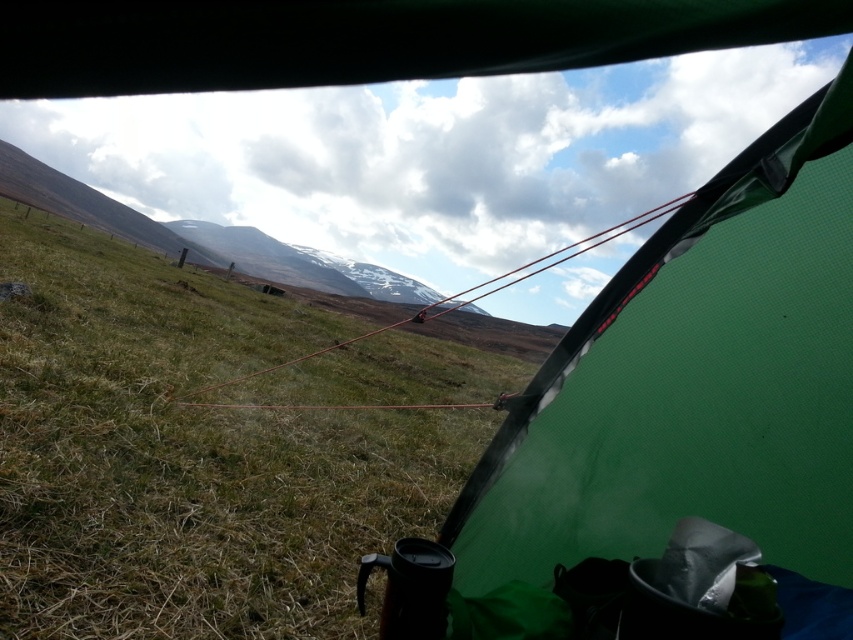
You are setting up a tent and want to place a small bag on the ground near the tent. Based on the scene, where should you place the bag so it is closer to the green mesh tent at center but still on the green grassy at lower left?

The green grassy at lower left is located above the green mesh tent at center, so placing the bag on the green grassy at lower left area near the tent would position it closer to the tent while remaining on the grass.

You are setting up a tent and have a green mesh tent at center. You also see green grassy at lower left. Which area would be better for placing the tent to ensure it doesn

The green grassy at lower left has a larger size compared to the green mesh tent at center, so placing the tent on the green grassy at lower left would provide enough space for the tent.